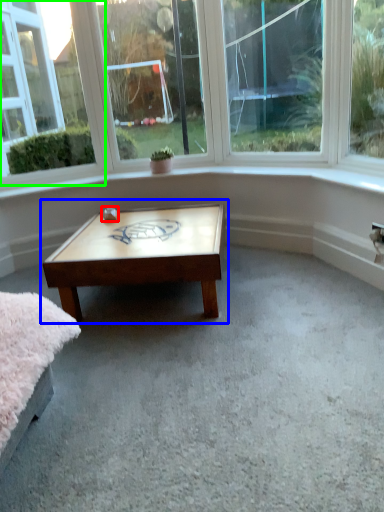
Question: Considering the real-world distances, which object is closest to table (highlighted by a red box)? coffee table (highlighted by a blue box) or window (highlighted by a green box).

Choices:
 (A) coffee table
 (B) window

Answer: (A)